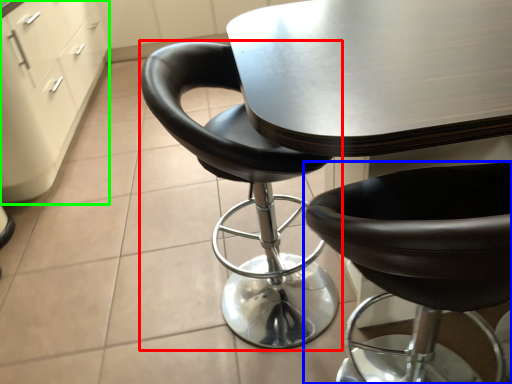
Question: Which object is the closest to the chair (highlighted by a red box)? Choose among these: chair (highlighted by a blue box) or file cabinet (highlighted by a green box).

Choices:
 (A) chair
 (B) file cabinet

Answer: (A)